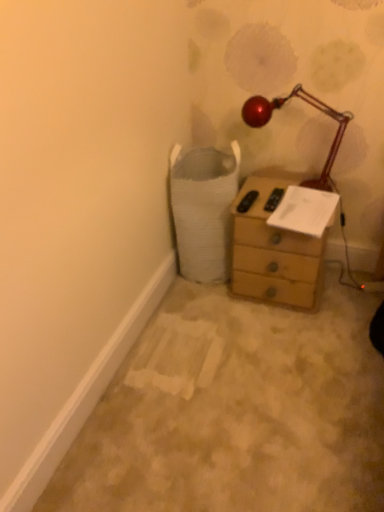
Question: Does white paper at upper right have a larger size compared to wooden chest of drawers at center?

Choices:
 (A) yes
 (B) no

Answer: (B)

Question: Is white paper at upper right located outside wooden chest of drawers at center?

Choices:
 (A) no
 (B) yes

Answer: (A)

Question: From the image's perspective, is white paper at upper right on top of wooden chest of drawers at center?

Choices:
 (A) no
 (B) yes

Answer: (B)

Question: From the image's perspective, is white paper at upper right under wooden chest of drawers at center?

Choices:
 (A) yes
 (B) no

Answer: (B)

Question: Is white paper at upper right smaller than wooden chest of drawers at center?

Choices:
 (A) yes
 (B) no

Answer: (A)

Question: Does white paper at upper right have a lesser width compared to wooden chest of drawers at center?

Choices:
 (A) yes
 (B) no

Answer: (A)

Question: From a real-world perspective, is wooden chest of drawers at center below metallic red lamp at upper right?

Choices:
 (A) no
 (B) yes

Answer: (B)

Question: Can you see wooden chest of drawers at center touching metallic red lamp at upper right?

Choices:
 (A) no
 (B) yes

Answer: (A)

Question: Is wooden chest of drawers at center not within metallic red lamp at upper right?

Choices:
 (A) yes
 (B) no

Answer: (A)

Question: Is wooden chest of drawers at center positioned with its back to metallic red lamp at upper right?

Choices:
 (A) no
 (B) yes

Answer: (A)

Question: Is wooden chest of drawers at center further to the viewer compared to metallic red lamp at upper right?

Choices:
 (A) yes
 (B) no

Answer: (A)

Question: Does wooden chest of drawers at center have a greater width compared to metallic red lamp at upper right?

Choices:
 (A) no
 (B) yes

Answer: (B)

Question: From a real-world perspective, is wooden chest of drawers at center physically above white paper at upper right?

Choices:
 (A) yes
 (B) no

Answer: (B)